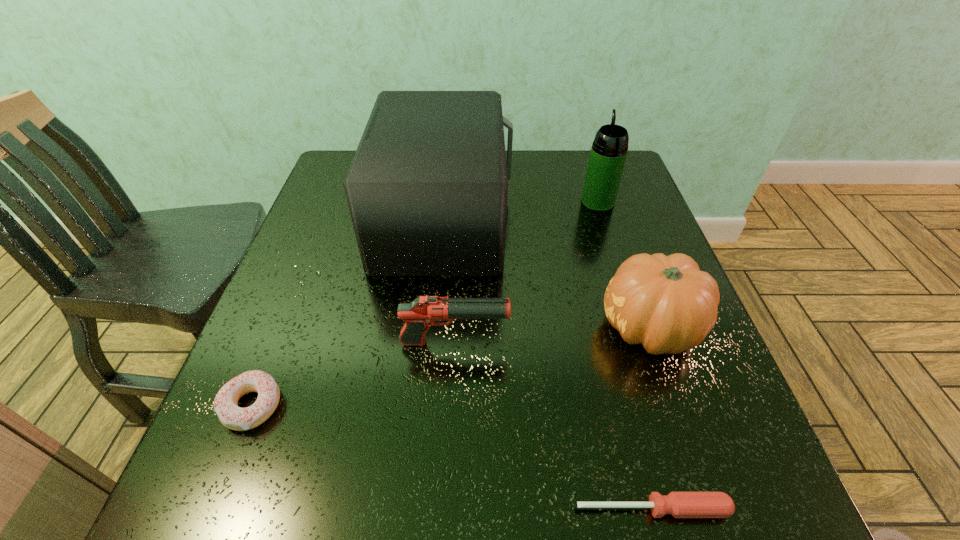
Where is `free spot at the right edge of the desktop`? This screenshot has width=960, height=540. free spot at the right edge of the desktop is located at coordinates (673, 387).

The width and height of the screenshot is (960, 540). In order to click on free location at the near left corner in this screenshot , I will do `click(236, 470)`.

I want to click on blank space at the far right corner of the desktop, so click(x=623, y=171).

At what (x,y) coordinates should I click in order to perform the action: click on vacant space in between the fifth farthest object and the fourth tallest object. Please return your answer as a coordinate pair (x, y). Looking at the image, I should click on (353, 374).

This screenshot has width=960, height=540. What are the coordinates of `vacant space that is in between the thermos bottle and the shortest object` in the screenshot? It's located at (625, 355).

Image resolution: width=960 pixels, height=540 pixels. What are the coordinates of `vacant space that is in between the microwave oven and the doughnut` in the screenshot? It's located at pyautogui.click(x=348, y=312).

Find the location of `free spot between the pumpkin and the gun`. free spot between the pumpkin and the gun is located at coordinates tap(552, 335).

Find the location of a particular element. The height and width of the screenshot is (540, 960). unoccupied position between the pumpkin and the microwave oven is located at coordinates (547, 273).

Identify the location of free spot between the doughnut and the microwave oven. (348, 312).

Locate an element on the screen. This screenshot has height=540, width=960. vacant space in between the thermos bottle and the microwave oven is located at coordinates (520, 210).